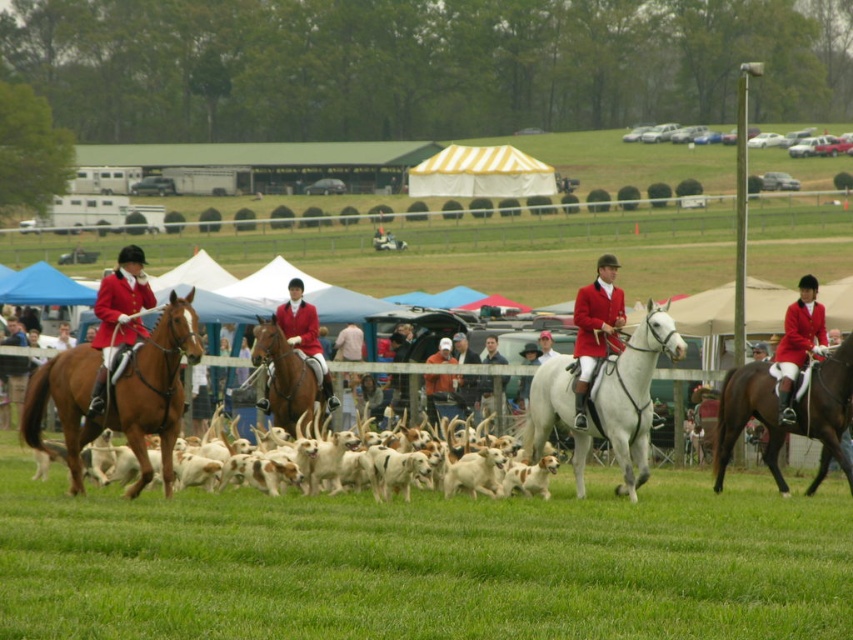
You are a photographer standing at the edge of the field. You want to take a photo that includes both the shiny brown horse at left and the shiny brown horse at center. What is the minimum distance you need to move backward to ensure both horses are fully visible in your shot?

The shiny brown horse at left is 4.37 meters from the shiny brown horse at center. To include both in your photo, you need to move backward at least 4.37 meters to ensure both are fully visible.

You are a photographer positioned at the edge of the field. You want to take a photo that includes both the brown glossy horse at right and the matte red jacket at right. Which object will appear larger in your photo?

The brown glossy horse at right will appear larger in the photo because it is closer to the viewer than the matte red jacket at right.